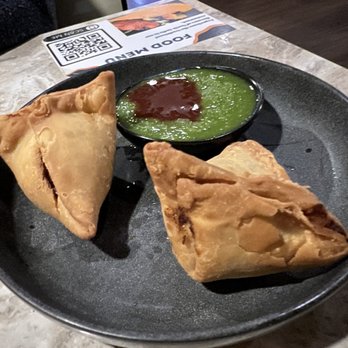
At what (x,y) coordinates should I click in order to perform the action: click on placemat lower right of plate. Please return your answer as a coordinate pair (x, y). Image resolution: width=348 pixels, height=348 pixels. Looking at the image, I should click on (329, 327).